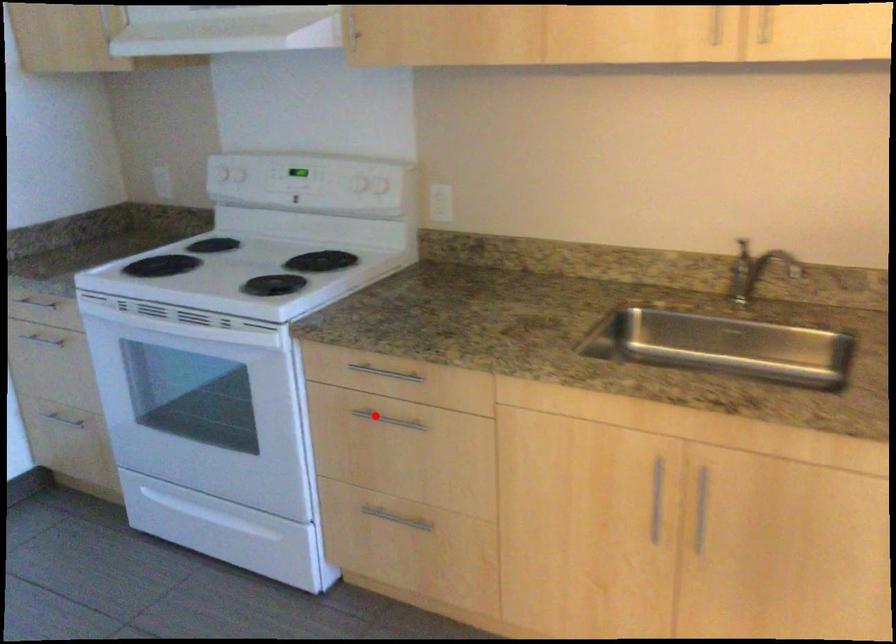
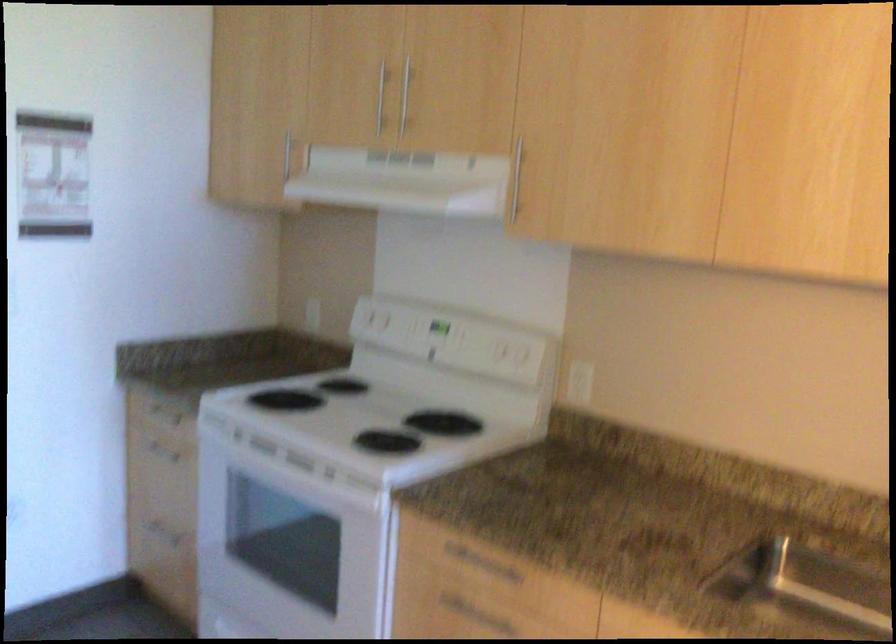
Find the pixel in the second image that matches the highlighted location in the first image.

(466, 609)